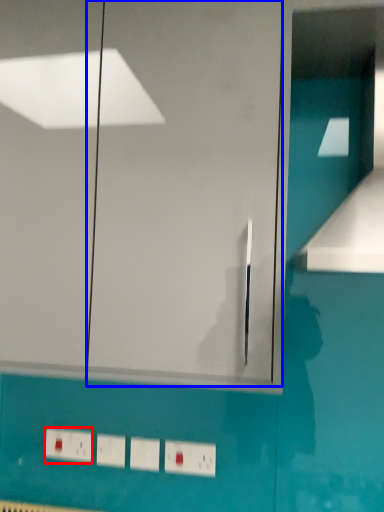
Question: Which object appears closest to the camera in this image, electric outlet (highlighted by a red box) or glass door (highlighted by a blue box)?

Choices:
 (A) electric outlet
 (B) glass door

Answer: (B)